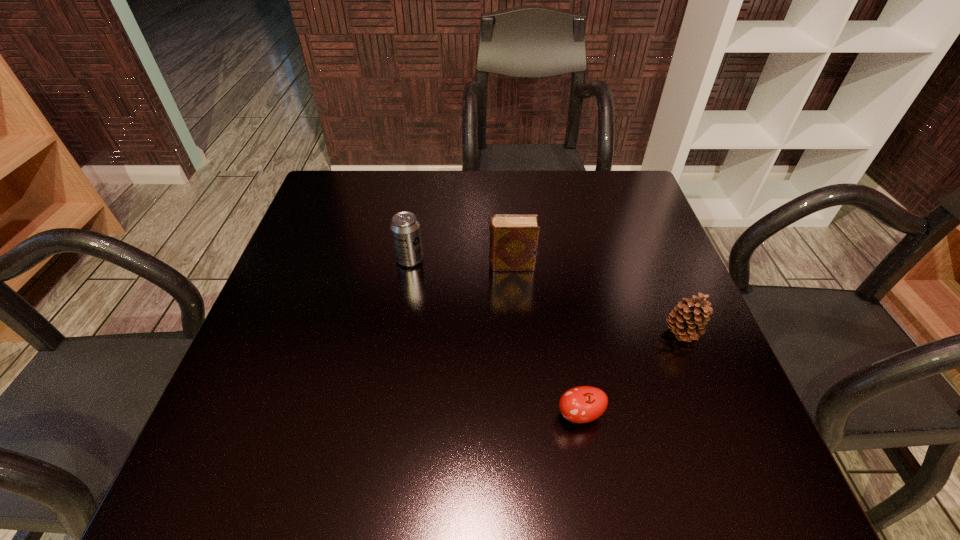
The height and width of the screenshot is (540, 960). I want to click on the second closest object to the third object from right to left, so click(x=688, y=318).

Where is `object that is the nearest to the rightmost object`? Image resolution: width=960 pixels, height=540 pixels. object that is the nearest to the rightmost object is located at coordinates (582, 404).

Find the location of `free location that satisfies the following two spatial constraints: 1. on the spine side of the rightmost object; 2. on the right side of the diary`. free location that satisfies the following two spatial constraints: 1. on the spine side of the rightmost object; 2. on the right side of the diary is located at coordinates (516, 333).

Locate an element on the screen. This screenshot has height=540, width=960. free space that satisfies the following two spatial constraints: 1. on the spine side of the rightmost object; 2. on the right side of the diary is located at coordinates (516, 333).

This screenshot has width=960, height=540. I want to click on vacant space that satisfies the following two spatial constraints: 1. on the spine side of the second object from left to right; 2. on the right side of the rightmost object, so click(x=516, y=333).

I want to click on vacant space that satisfies the following two spatial constraints: 1. on the spine side of the pinecone; 2. on the left side of the diary, so coord(516,333).

I want to click on free space in the image that satisfies the following two spatial constraints: 1. on the spine side of the second object from right to left; 2. on the left side of the third object from right to left, so click(522, 415).

Where is `blank space that satisfies the following two spatial constraints: 1. on the front side of the shortest object; 2. on the right side of the beer can`? blank space that satisfies the following two spatial constraints: 1. on the front side of the shortest object; 2. on the right side of the beer can is located at coordinates (384, 415).

Find the location of a particular element. vacant area in the image that satisfies the following two spatial constraints: 1. on the front side of the leftmost object; 2. on the right side of the shortest object is located at coordinates (384, 415).

I want to click on vacant point that satisfies the following two spatial constraints: 1. on the spine side of the nearest object; 2. on the right side of the third object from right to left, so click(x=522, y=415).